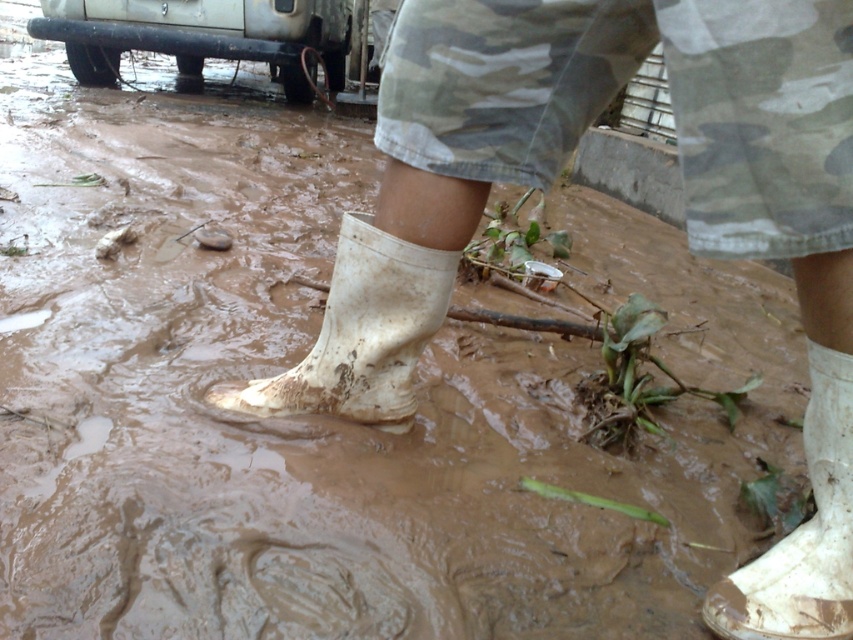
Can you confirm if white matte boot at lower right is wider than silver metallic bumper at upper left?

In fact, white matte boot at lower right might be narrower than silver metallic bumper at upper left.

I want to click on white matte boot at lower right, so pos(804,532).

Who is more distant from viewer, (846, 532) or (318, 28)?

Positioned behind is point (318, 28).

Where is `white matte boot at lower right`? The image size is (853, 640). white matte boot at lower right is located at coordinates (804, 532).

Does white rubber boot at center appear under silver metallic bumper at upper left?

Correct, white rubber boot at center is located below silver metallic bumper at upper left.

Is white rubber boot at center to the left of silver metallic bumper at upper left from the viewer's perspective?

Incorrect, white rubber boot at center is not on the left side of silver metallic bumper at upper left.

The image size is (853, 640). In order to click on white rubber boot at center in this screenshot , I will do `click(361, 333)`.

Find the location of a particular element. white rubber boot at center is located at coordinates (361, 333).

In the scene shown: Who is positioned more to the right, white rubber boot at center or white matte boot at lower right?

white matte boot at lower right

Is white rubber boot at center bigger than white matte boot at lower right?

Indeed, white rubber boot at center has a larger size compared to white matte boot at lower right.

Locate an element on the screen. white rubber boot at center is located at coordinates (361, 333).